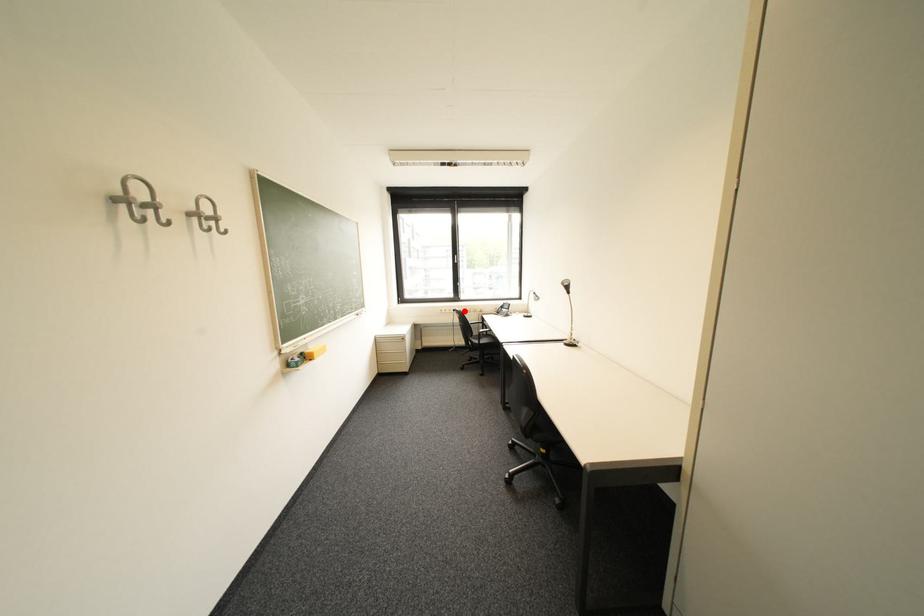
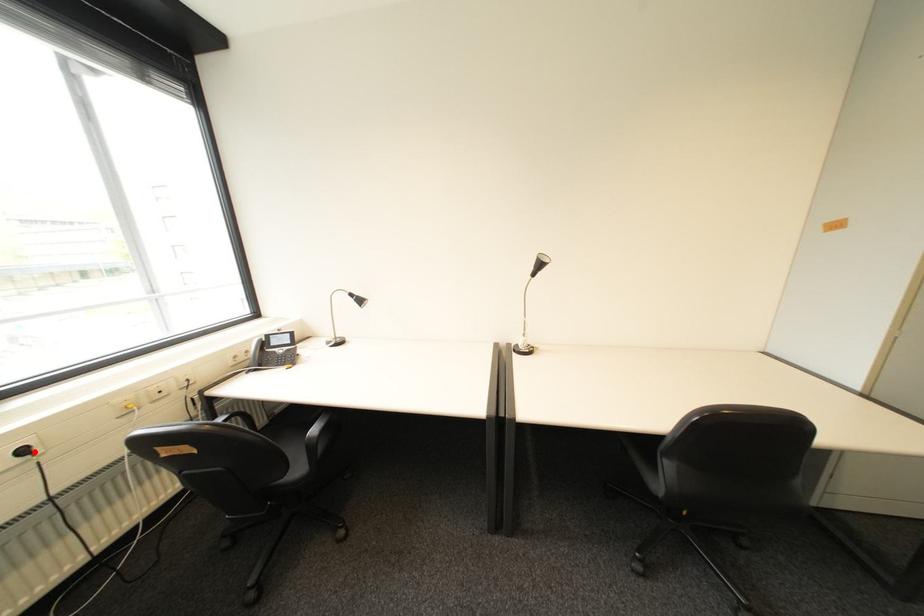
I am providing you with two images of the same scene from different viewpoints. A red point is marked on the first image and another point is marked on the second image. Does the point marked in image1 correspond to the same location as the one in image2?

Yes